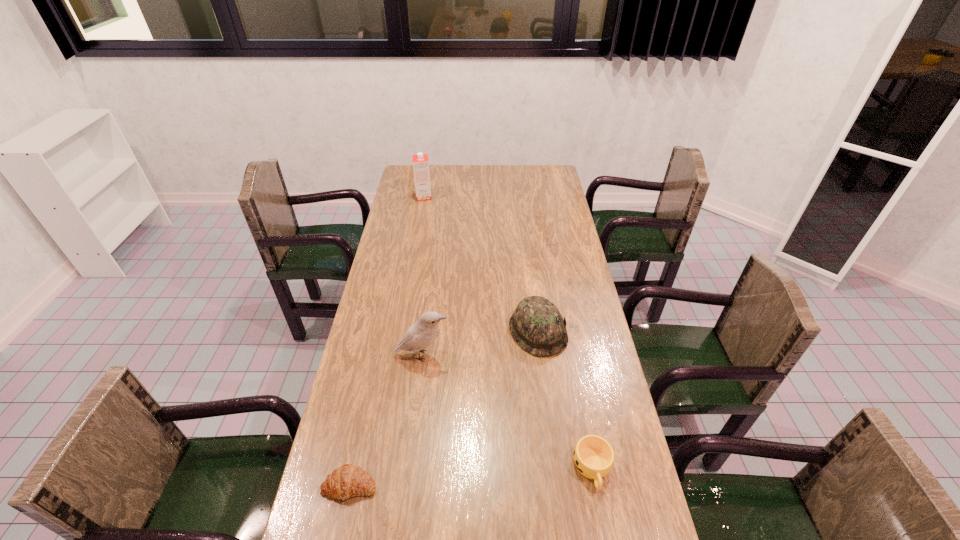
You are a GUI agent. You are given a task and a screenshot of the screen. Output one action in this format:
    pyautogui.click(x=<x>, y=<y>)
    Task: Click on the empty space between the carton and the third tallest object
    
    Given the screenshot: What is the action you would take?
    pyautogui.click(x=481, y=264)

Where is `vacant area that lies between the cup and the farthest object`? The height and width of the screenshot is (540, 960). vacant area that lies between the cup and the farthest object is located at coordinates (508, 333).

The image size is (960, 540). Find the location of `blank region between the bird and the headwear`. blank region between the bird and the headwear is located at coordinates (480, 343).

The height and width of the screenshot is (540, 960). Identify the location of free space between the bird and the third tallest object. (480, 343).

The image size is (960, 540). In order to click on the third closest object relative to the cup in this screenshot , I will do click(x=347, y=481).

Find the location of a particular element. This screenshot has width=960, height=540. object that is the third closest to the carton is located at coordinates (347, 481).

Where is `free point that satisfies the following two spatial constraints: 1. at the beak of the bird; 2. on the back side of the cup`? free point that satisfies the following two spatial constraints: 1. at the beak of the bird; 2. on the back side of the cup is located at coordinates (409, 469).